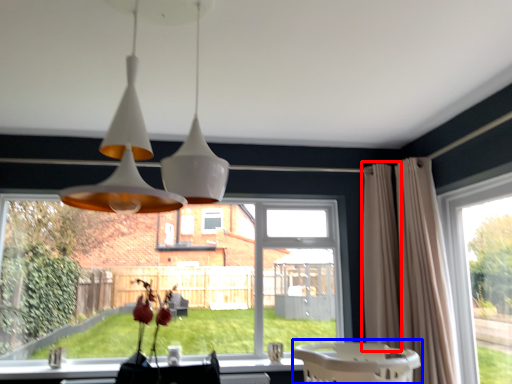
Question: Which object is closer to the camera taking this photo, curtain (highlighted by a red box) or baby carriage (highlighted by a blue box)?

Choices:
 (A) curtain
 (B) baby carriage

Answer: (B)